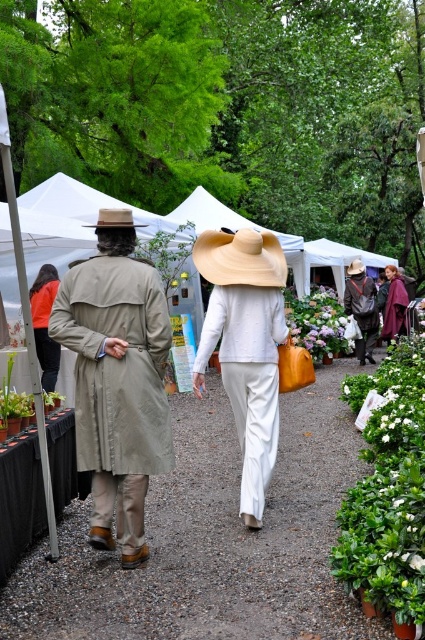
Question: Which point is farther from the camera taking this photo?

Choices:
 (A) (365, 353)
 (B) (121, 224)

Answer: (A)

Question: Among these points, which one is nearest to the camera?

Choices:
 (A) pyautogui.click(x=252, y=259)
 (B) pyautogui.click(x=285, y=449)
 (C) pyautogui.click(x=155, y=410)
 (D) pyautogui.click(x=393, y=321)

Answer: (C)

Question: In this image, where is beige straw hat at center located relative to orange fabric shirt at left?

Choices:
 (A) below
 (B) above

Answer: (B)

Question: Can you confirm if beige straw hat at center is smaller than brown leather hat at center?

Choices:
 (A) yes
 (B) no

Answer: (A)

Question: Is maroon velvet cape at center to the left of brown straw cowboy hat at center from the viewer's perspective?

Choices:
 (A) no
 (B) yes

Answer: (A)

Question: Which object is closer to the camera taking this photo?

Choices:
 (A) brown straw cowboy hat at center
 (B) brown felt cowboy hat at upper center
 (C) matte white hat at center

Answer: (B)